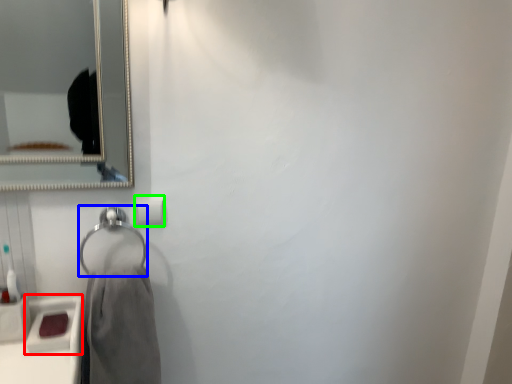
Question: Which object is the closest to the sink (highlighted by a red box)? Choose among these: hang (highlighted by a blue box) or toilet paper (highlighted by a green box).

Choices:
 (A) hang
 (B) toilet paper

Answer: (A)